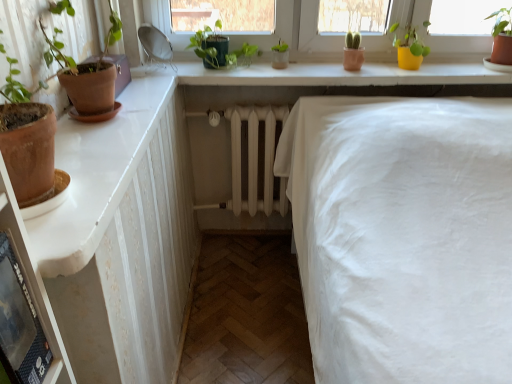
Where is `free space on the front side of green matte flowerpot at center`? Image resolution: width=512 pixels, height=384 pixels. free space on the front side of green matte flowerpot at center is located at coordinates (280, 73).